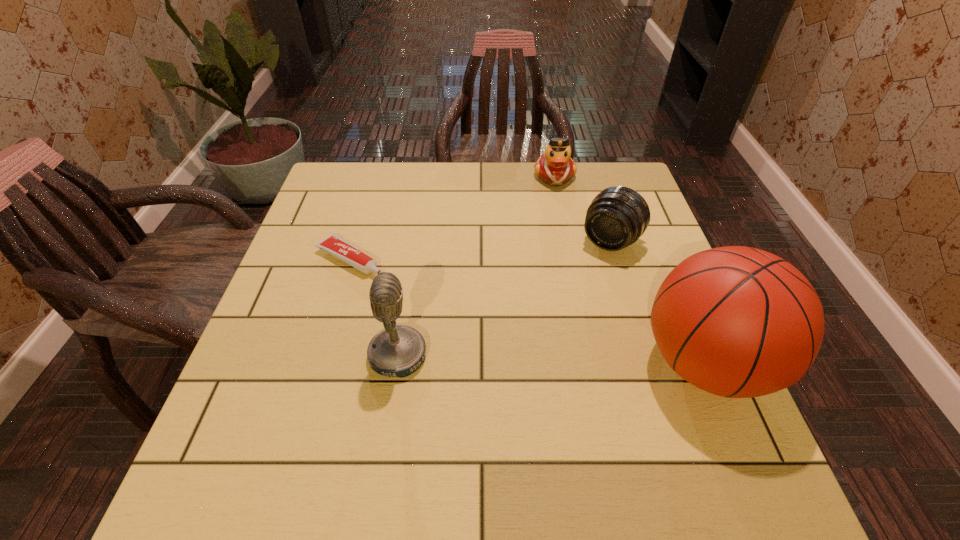
Identify the location of vacant space at the far right corner of the desktop. Image resolution: width=960 pixels, height=540 pixels. (617, 166).

At what (x,y) coordinates should I click in order to perform the action: click on vacant region at the near right corner of the desktop. Please return your answer as a coordinate pair (x, y). The width and height of the screenshot is (960, 540). Looking at the image, I should click on (731, 399).

You are a GUI agent. You are given a task and a screenshot of the screen. Output one action in this format:
    pyautogui.click(x=<x>, y=<y>)
    Task: Click on the free area in between the second object from left to right and the duck
    The image size is (960, 540).
    Given the screenshot: What is the action you would take?
    pyautogui.click(x=476, y=266)

The image size is (960, 540). What are the coordinates of `vacant region between the tallest object and the duck` in the screenshot? It's located at (630, 269).

Identify the location of unoccupied area between the telephoto lens and the duck. (583, 208).

What are the coordinates of `vacant space that's between the microphone and the basketball` in the screenshot? It's located at (551, 359).

The width and height of the screenshot is (960, 540). In order to click on free area in between the shortest object and the tallest object in this screenshot , I will do `click(527, 311)`.

Identify the location of vacant space in between the tallest object and the leftmost object. The image size is (960, 540). (527, 311).

Locate an element on the screen. free spot between the shortest object and the telephoto lens is located at coordinates (480, 250).

What are the coordinates of `free point between the telephoto lens and the farthest object` in the screenshot? It's located at (583, 208).